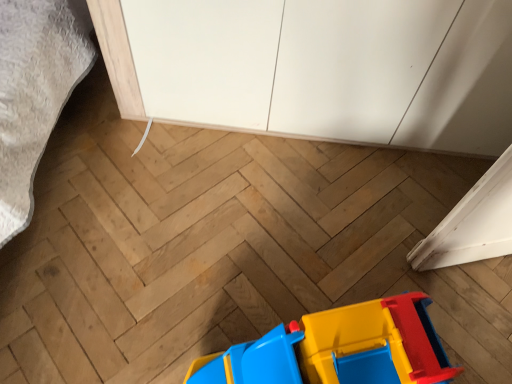
Where is `vacant space behind matte plastic toy at lower center`? The width and height of the screenshot is (512, 384). vacant space behind matte plastic toy at lower center is located at coordinates (304, 248).